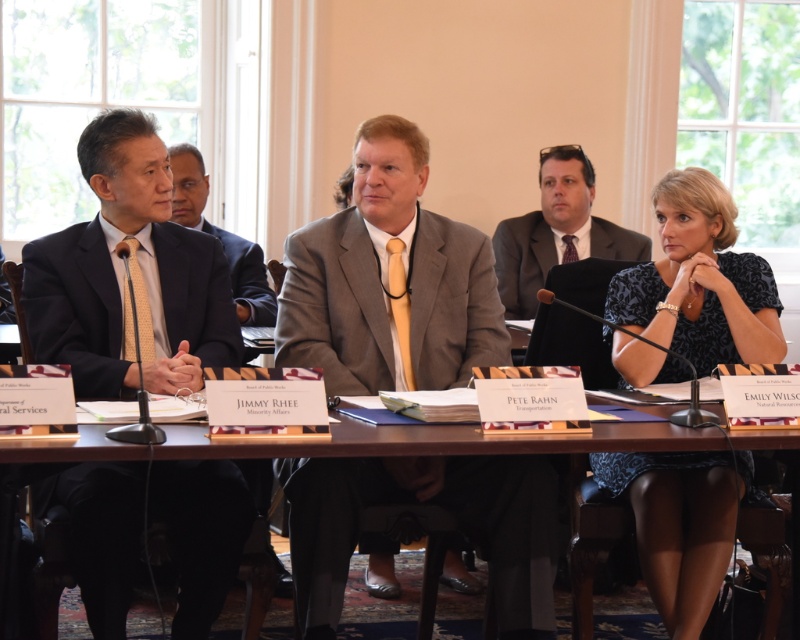
Question: Which point appears farthest from the camera in this image?

Choices:
 (A) (218, 451)
 (B) (544, 268)

Answer: (B)

Question: In this image, where is dark blue suit at left located relative to matte gray suit at center?

Choices:
 (A) below
 (B) above

Answer: (A)

Question: From the image, what is the correct spatial relationship of matte gray suit at center in relation to matte black suit at center?

Choices:
 (A) left
 (B) right

Answer: (B)

Question: Where is blue dotted blouse at center located in relation to brown wooden table at center in the image?

Choices:
 (A) left
 (B) right

Answer: (B)

Question: Which of these objects is positioned closest to the dark blue suit at left?

Choices:
 (A) matte black suit at center
 (B) brown wooden table at center

Answer: (B)

Question: Among these objects, which one is nearest to the camera?

Choices:
 (A) matte black suit at center
 (B) light gray wool suit at center
 (C) dark blue suit at left

Answer: (C)